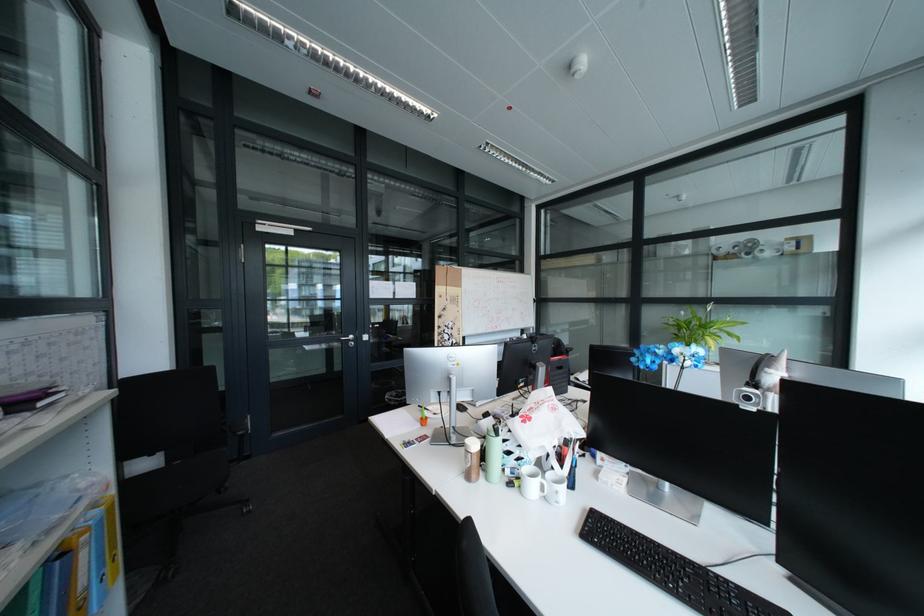
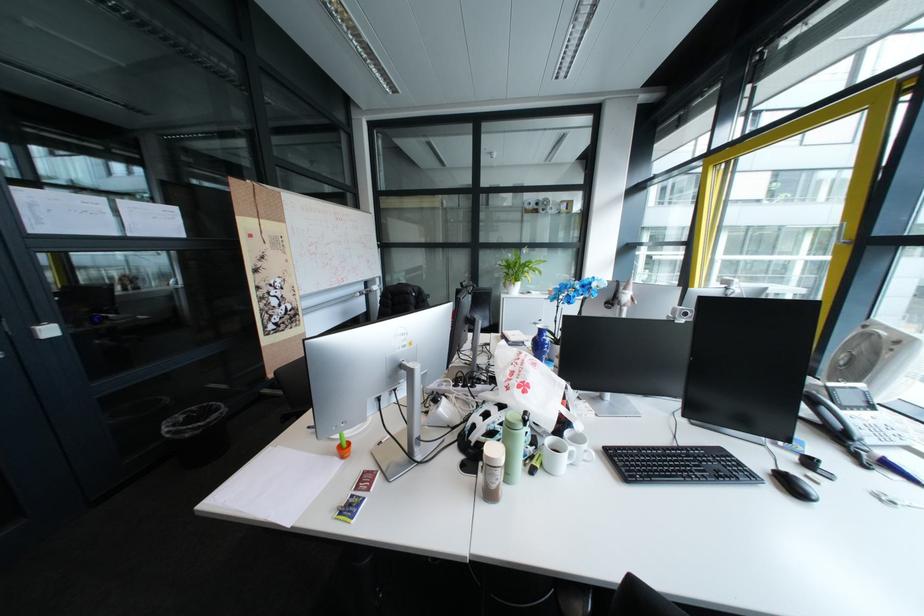
Where in the second image is the point corresponding to pixel 414 391 from the first image?

(208, 408)